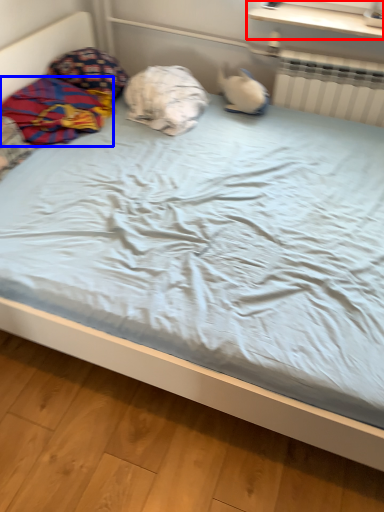
Question: Among these objects, which one is farthest to the camera, window sill (highlighted by a red box) or material (highlighted by a blue box)?

Choices:
 (A) window sill
 (B) material

Answer: (A)